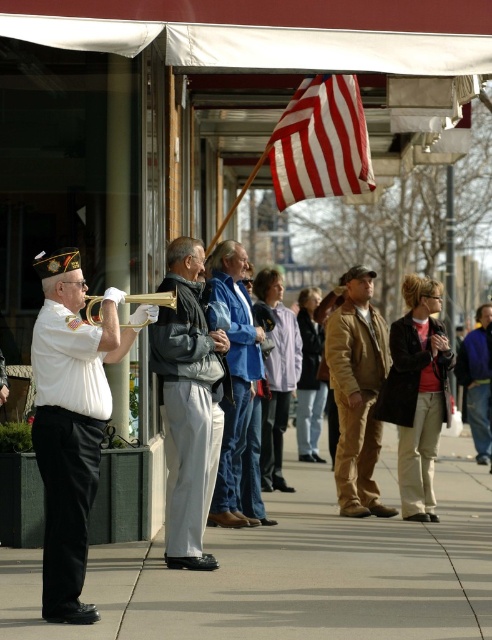
Question: Which of the following is the farthest from the observer?

Choices:
 (A) gray concrete sidewalk at center
 (B) brown leather jacket at center
 (C) blue denim jeans at center
 (D) blue fleece jacket at right

Answer: (D)

Question: Does white matte uniform at left appear on the left side of red/white striped fabric flag at upper center?

Choices:
 (A) no
 (B) yes

Answer: (B)

Question: Is the position of gray concrete sidewalk at center less distant than that of blue denim jeans at center?

Choices:
 (A) no
 (B) yes

Answer: (A)

Question: Can you confirm if dark brown leather jacket at center is smaller than blue denim jeans at center?

Choices:
 (A) yes
 (B) no

Answer: (A)

Question: Which of the following is the closest to the observer?

Choices:
 (A) [x=274, y=332]
 (B) [x=181, y=390]
 (C) [x=366, y=312]

Answer: (B)

Question: Among these objects, which one is nearest to the camera?

Choices:
 (A) tan leather jacket at center
 (B) gray fabric jacket at center
 (C) red/white striped fabric flag at upper center

Answer: (B)